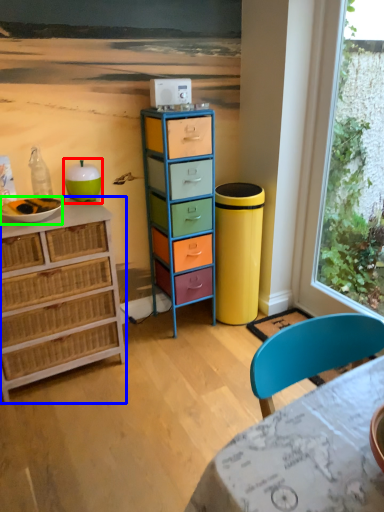
Question: Estimate the real-world distances between objects in this image. Which object is farther from teal (highlighted by a red box), chest of drawers (highlighted by a blue box) or bowl (highlighted by a green box)?

Choices:
 (A) chest of drawers
 (B) bowl

Answer: (A)